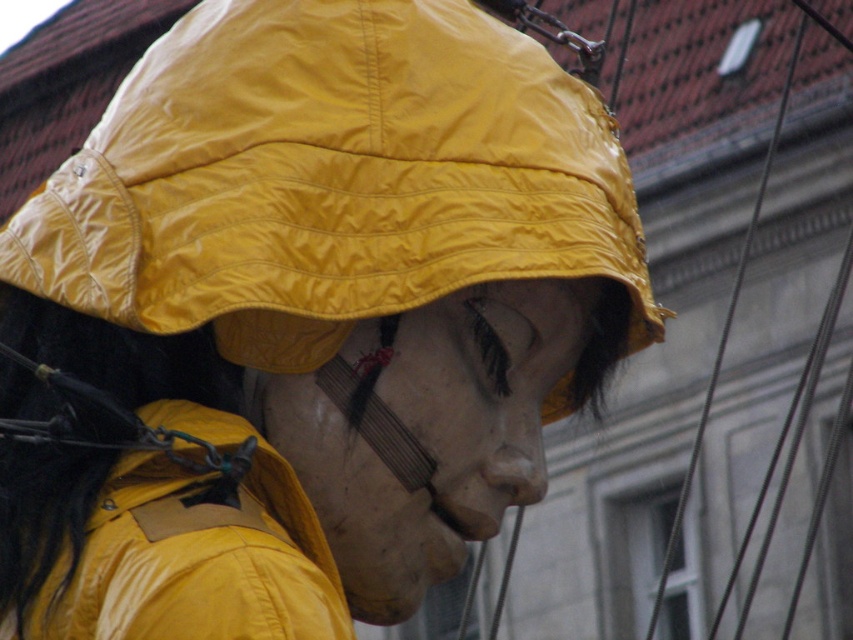
You are a fashion designer observing a person in the image. You need to determine if the yellow matte hat at center can be worn over the matte yellow jacket at lower left without any adjustments. Based on their sizes, what do you think?

The yellow matte hat at center is much taller than the matte yellow jacket at lower left, so it can be worn over the jacket without any adjustments needed.

You are a drone operator trying to navigate between two points in the scene. The first point is at coordinates point (39, 198) and the second is at point (379, 492). According to the image, which point is closer to the front of the scene?

Point (379, 492) is closer to the front of the scene because it is in front of point (39, 198).